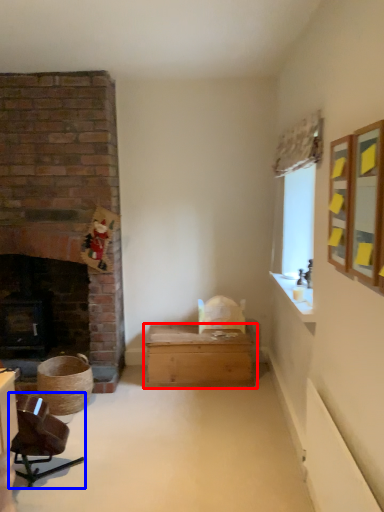
Question: Which object is further to the camera taking this photo, table (highlighted by a red box) or chair (highlighted by a blue box)?

Choices:
 (A) table
 (B) chair

Answer: (A)